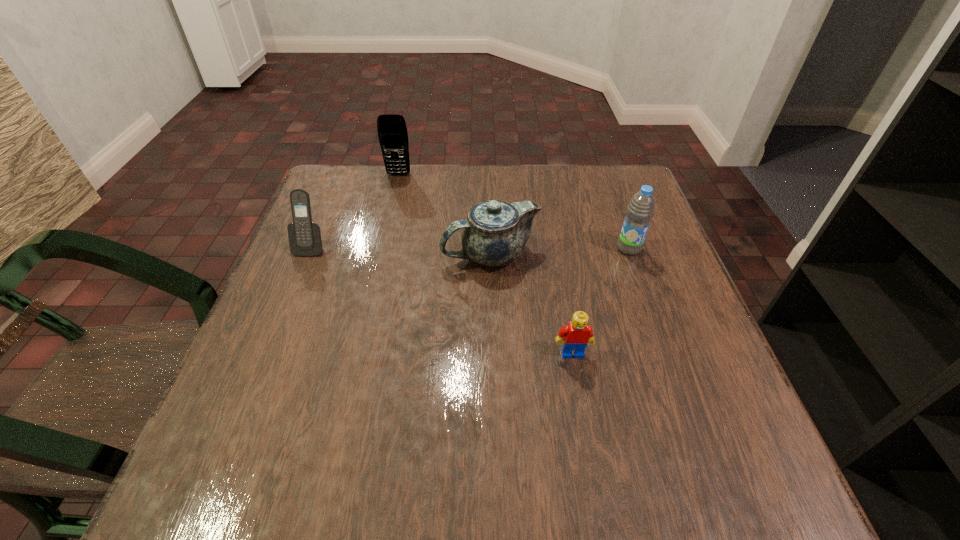
Find the location of a particular element. This screenshot has height=540, width=960. free location that satisfies the following two spatial constraints: 1. on the screen of the rightmost object; 2. on the left side of the taller cellular telephone is located at coordinates (381, 248).

Find the location of `blank space that satisfies the following two spatial constraints: 1. on the screen of the water bottle; 2. on the left side of the second object from left to right`. blank space that satisfies the following two spatial constraints: 1. on the screen of the water bottle; 2. on the left side of the second object from left to right is located at coordinates (381, 248).